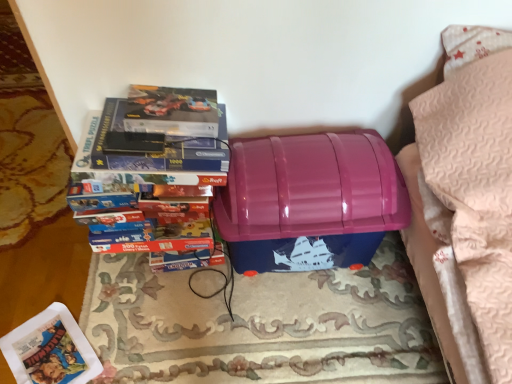
You are a GUI agent. You are given a task and a screenshot of the screen. Output one action in this format:
    pyautogui.click(x=<x>, y=<y>)
    Task: Click on the free spot in front of glossy plastic storage box at center
    The image size is (512, 384).
    Given the screenshot: What is the action you would take?
    pyautogui.click(x=302, y=337)